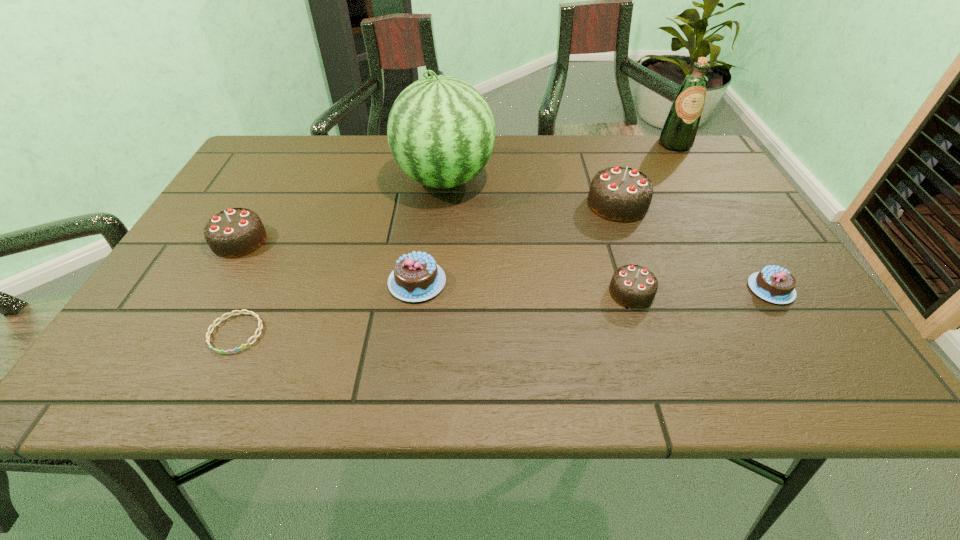
Identify the location of empty space between the farthest chocolate cake and the green watermelon. The height and width of the screenshot is (540, 960). (531, 192).

The image size is (960, 540). I want to click on free space between the shortest object and the seventh shortest object, so click(455, 239).

At what (x,y) coordinates should I click in order to perform the action: click on free space between the seventh shortest object and the left pink chocolate cake. Please return your answer as a coordinate pair (x, y). This screenshot has height=540, width=960. Looking at the image, I should click on (546, 213).

This screenshot has height=540, width=960. Find the location of `free spot between the olive oil and the nearest chocolate chocolate cake`. free spot between the olive oil and the nearest chocolate chocolate cake is located at coordinates (653, 218).

Where is `empty space that is in between the third tallest object and the left pink chocolate cake`? empty space that is in between the third tallest object and the left pink chocolate cake is located at coordinates (517, 243).

Identify the location of vacant area that lies between the bigger pink chocolate cake and the green watermelon. (431, 231).

The width and height of the screenshot is (960, 540). Identify the location of free space between the watermelon and the shortest object. (341, 256).

What are the coordinates of `the fourth closest object to the olive oil` in the screenshot? It's located at (634, 286).

Locate an element on the screen. The image size is (960, 540). object that is the sixth closest one to the rightmost chocolate cake is located at coordinates (213, 325).

Select which chocolate cake appears as the fourth closest to the second tallest object. Please provide its 2D coordinates. Your answer should be formatted as a tuple, i.e. [(x, y)], where the tuple contains the x and y coordinates of a point satisfying the conditions above.

[(416, 277)]